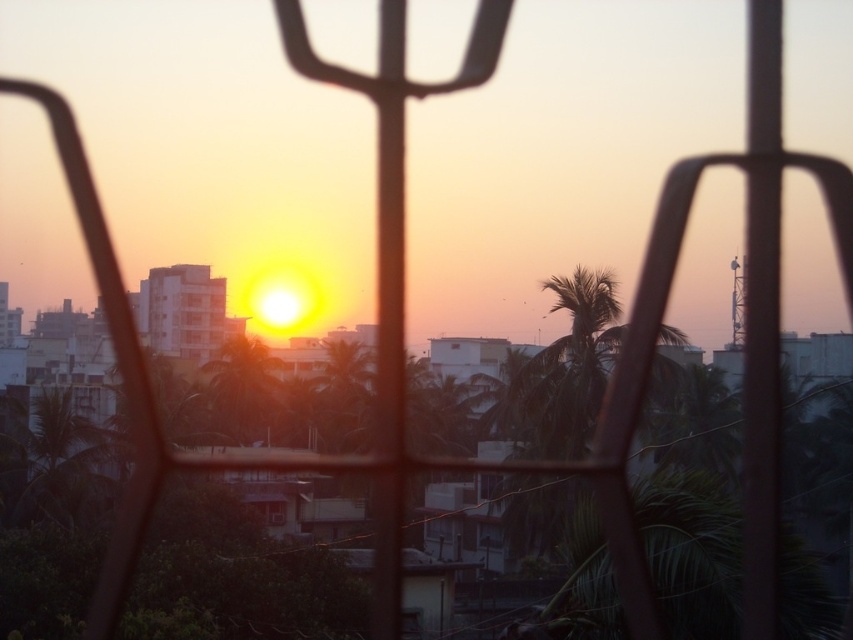
Who is positioned more to the right, green leafy palm tree at center or transparent glass window at center?

From the viewer's perspective, transparent glass window at center appears more on the right side.

Which is more to the left, green leafy palm tree at center or transparent glass window at center?

green leafy palm tree at center

Is point (241, 349) positioned in front of point (277, 516)?

No, it is not.

Where is `green leafy palm tree at center`? The image size is (853, 640). green leafy palm tree at center is located at coordinates (242, 392).